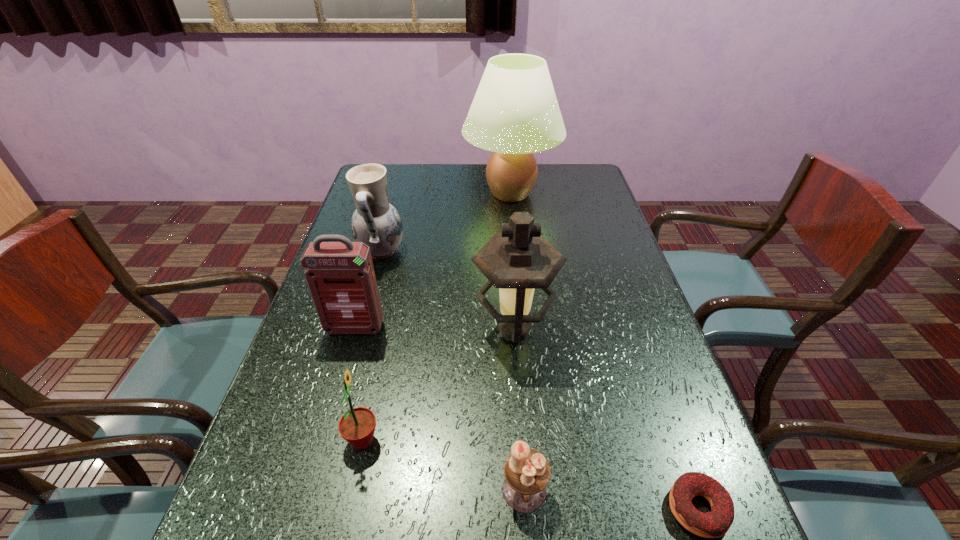
The width and height of the screenshot is (960, 540). What are the coordinates of `vacant point at the left edge` in the screenshot? It's located at (399, 207).

The image size is (960, 540). What are the coordinates of `free spot at the right edge of the desktop` in the screenshot? It's located at (635, 318).

Identify the location of blank space at the far left corner. The width and height of the screenshot is (960, 540). (391, 174).

What are the coordinates of `free space at the far right corner` in the screenshot? It's located at (577, 186).

The width and height of the screenshot is (960, 540). In order to click on empty location between the oil lamp and the first-aid kit in this screenshot , I will do `click(434, 329)`.

Locate an element on the screen. The width and height of the screenshot is (960, 540). free area in between the oil lamp and the third nearest object is located at coordinates (438, 384).

You are a GUI agent. You are given a task and a screenshot of the screen. Output one action in this format:
    pyautogui.click(x=<x>, y=<y>)
    Task: Click on the free space between the second shortest object and the sunflower
    
    Given the screenshot: What is the action you would take?
    pyautogui.click(x=444, y=465)

The width and height of the screenshot is (960, 540). I want to click on vacant area that lies between the farthest object and the pottery, so click(x=446, y=222).

Identify the location of free point between the oil lamp and the first-aid kit. Image resolution: width=960 pixels, height=540 pixels. coord(434,329).

Identify which object is the closest to the first-aid kit. Please provide its 2D coordinates. Your answer should be formatted as a tuple, i.e. [(x, y)], where the tuple contains the x and y coordinates of a point satisfying the conditions above.

[(375, 222)]